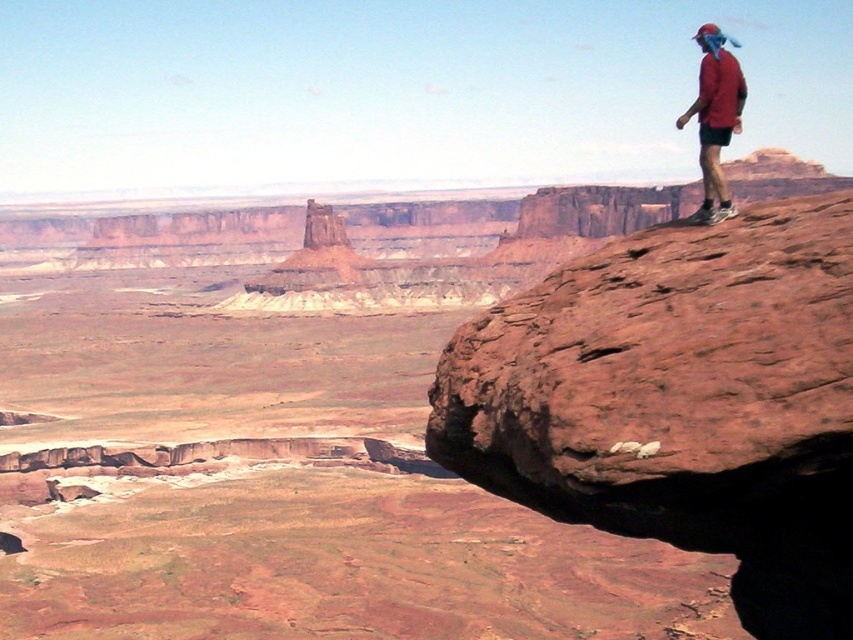
Find the location of a particular element. rusty rock at upper right is located at coordinates (680, 401).

Looking at this image, is the position of rusty rock at upper right more distant than that of red matte shirt at upper right?

No, it is in front of red matte shirt at upper right.

Image resolution: width=853 pixels, height=640 pixels. Identify the location of rusty rock at upper right. (680, 401).

The image size is (853, 640). I want to click on rusty rock at upper right, so click(680, 401).